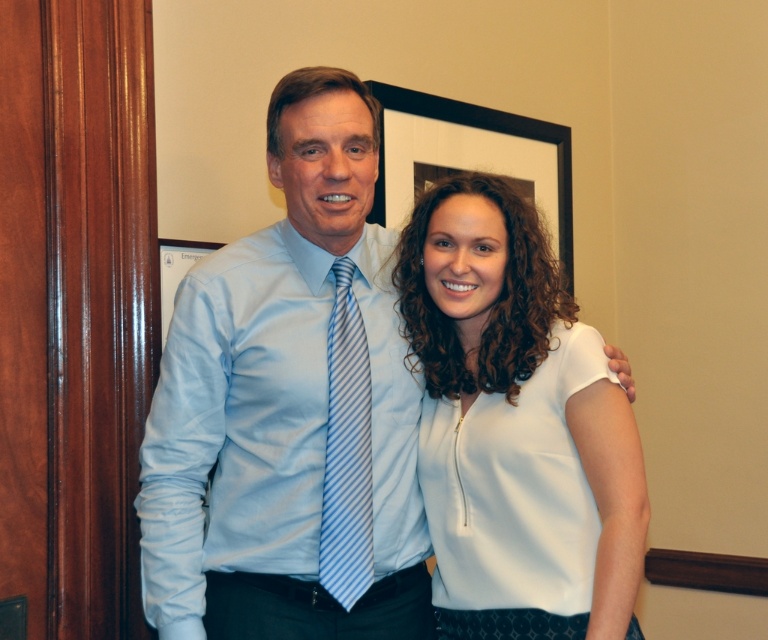
Can you confirm if black matte picture frame at upper center is smaller than matte blue shirt at left?

No, black matte picture frame at upper center is not smaller than matte blue shirt at left.

Is black matte picture frame at upper center taller than matte blue shirt at left?

Yes.

Does point (402, 148) come behind point (164, 280)?

That is True.

Where is `black matte picture frame at upper center`? black matte picture frame at upper center is located at coordinates (469, 157).

At what (x,y) coordinates should I click in order to perform the action: click on light blue shirt at center. Please return your answer as a coordinate pair (x, y). This screenshot has height=640, width=768. Looking at the image, I should click on (290, 406).

Is light blue shirt at center in front of white smooth blouse at center?

No, it is behind white smooth blouse at center.

Where is `light blue shirt at center`? The height and width of the screenshot is (640, 768). light blue shirt at center is located at coordinates (290, 406).

Is light blue shirt at center further to the viewer compared to blue striped tie at center?

No, light blue shirt at center is in front of blue striped tie at center.

Is point (199, 515) closer to camera compared to point (339, 308)?

Yes, it is.

Where is `light blue shirt at center`? light blue shirt at center is located at coordinates (290, 406).

The image size is (768, 640). I want to click on light blue shirt at center, so click(290, 406).